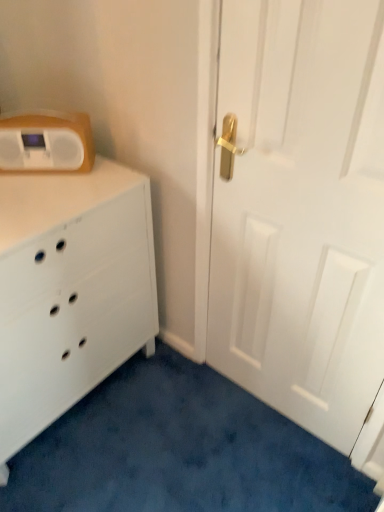
Locate an element on the screen. free space on the front side of matte white radio at upper left is located at coordinates (35, 189).